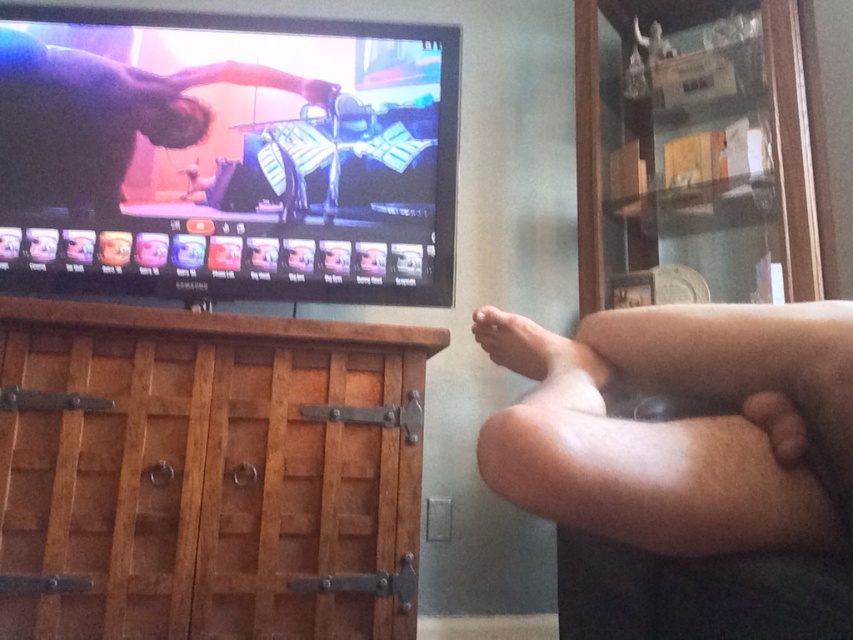
You are standing in the room and want to place a new TV stand that is 1.2 meters wide. The existing brown wood cabinet at left is located at point (209, 472). Can you fit the new TV stand next to the brown wood cabinet at left without overlapping?

The brown wood cabinet at left is located at point (209, 472). However, without knowing the dimensions of the room or the space available next to the cabinet, it is impossible to determine if the 1.2 meter wide TV stand can fit there. Additional measurements are needed.

You are a delivery person entering the room and need to place a package on the brown wood cabinet at left without touching the smooth skin at center. Is the cabinet accessible for placing the package?

The brown wood cabinet at left is located below smooth skin at center, so yes, the cabinet is accessible for placing the package as it is positioned lower than the smooth skin at center.

You are a delivery robot with a package that needs to be placed between the brown wood cabinet at left and the smooth skin at center. The package is 24 inches long. Can you fit it between them?

The distance between the brown wood cabinet at left and the smooth skin at center is 24.51 inches, which is slightly longer than the 24 inch package. Therefore, the package can fit between them with a small amount of space remaining.